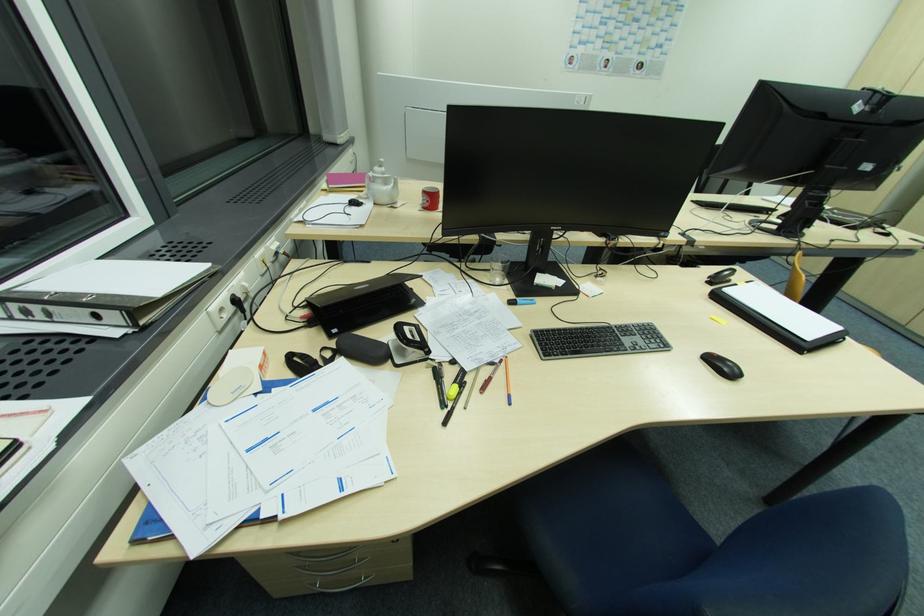
This screenshot has height=616, width=924. I want to click on closed black laptop, so click(363, 302).